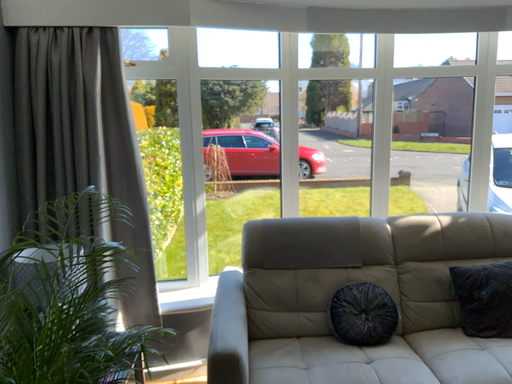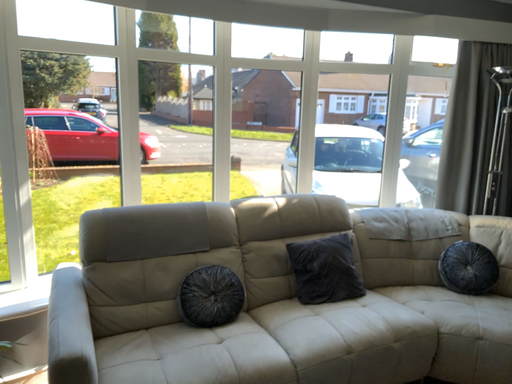
Question: Which way did the camera rotate in the video?

Choices:
 (A) rotated left
 (B) rotated right

Answer: (B)